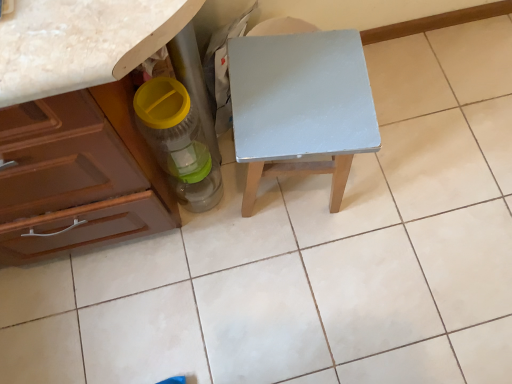
Question: Can you confirm if light gray wood table at center is bigger than translucent plastic bottle at lower left?

Choices:
 (A) yes
 (B) no

Answer: (A)

Question: From a real-world perspective, is light gray wood table at center below translucent plastic bottle at lower left?

Choices:
 (A) yes
 (B) no

Answer: (A)

Question: Does light gray wood table at center appear on the left side of translucent plastic bottle at lower left?

Choices:
 (A) yes
 (B) no

Answer: (B)

Question: Could you tell me if light gray wood table at center is facing translucent plastic bottle at lower left?

Choices:
 (A) no
 (B) yes

Answer: (A)

Question: Considering the relative sizes of light gray wood table at center and translucent plastic bottle at lower left in the image provided, is light gray wood table at center taller than translucent plastic bottle at lower left?

Choices:
 (A) no
 (B) yes

Answer: (B)

Question: From the image's perspective, is light gray wood table at center beneath translucent plastic bottle at lower left?

Choices:
 (A) yes
 (B) no

Answer: (B)

Question: Considering the relative sizes of translucent plastic bottle at lower left and light gray wood table at center in the image provided, is translucent plastic bottle at lower left bigger than light gray wood table at center?

Choices:
 (A) yes
 (B) no

Answer: (B)

Question: Is translucent plastic bottle at lower left looking in the opposite direction of light gray wood table at center?

Choices:
 (A) yes
 (B) no

Answer: (B)

Question: Is translucent plastic bottle at lower left taller than light gray wood table at center?

Choices:
 (A) yes
 (B) no

Answer: (B)

Question: From a real-world perspective, is translucent plastic bottle at lower left on light gray wood table at center?

Choices:
 (A) no
 (B) yes

Answer: (B)

Question: Is there a large distance between translucent plastic bottle at lower left and light gray wood table at center?

Choices:
 (A) yes
 (B) no

Answer: (B)

Question: Considering the relative positions of translucent plastic bottle at lower left and light gray wood table at center in the image provided, is translucent plastic bottle at lower left to the left of light gray wood table at center from the viewer's perspective?

Choices:
 (A) yes
 (B) no

Answer: (A)

Question: From the image's perspective, is translucent plastic bottle at lower left above or below light gray wood table at center?

Choices:
 (A) above
 (B) below

Answer: (B)